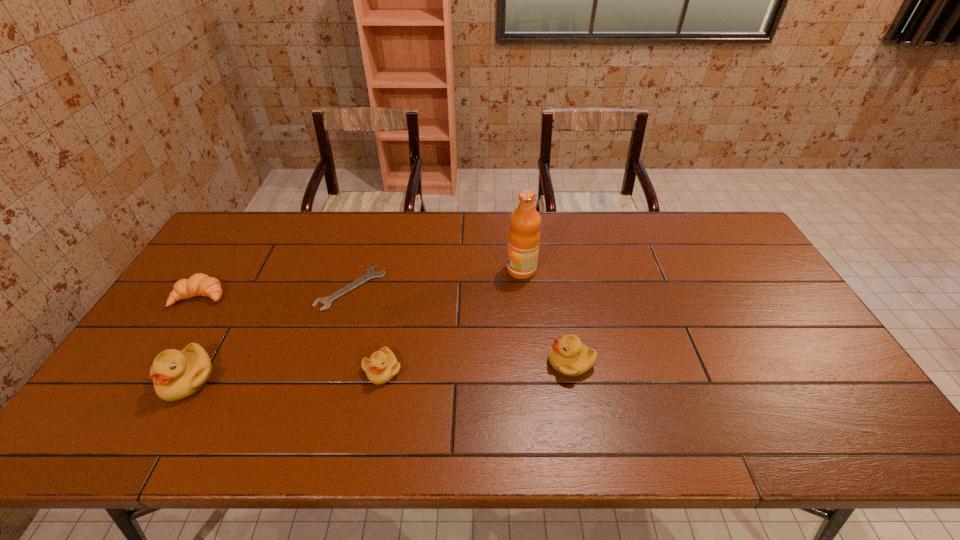
Considering the uniform spacing of ducklings, where should an additional duckling be positioned on the right? Please locate a free spot. Please provide its 2D coordinates. Your answer should be formatted as a tuple, i.e. [(x, y)], where the tuple contains the x and y coordinates of a point satisfying the conditions above.

[(754, 354)]